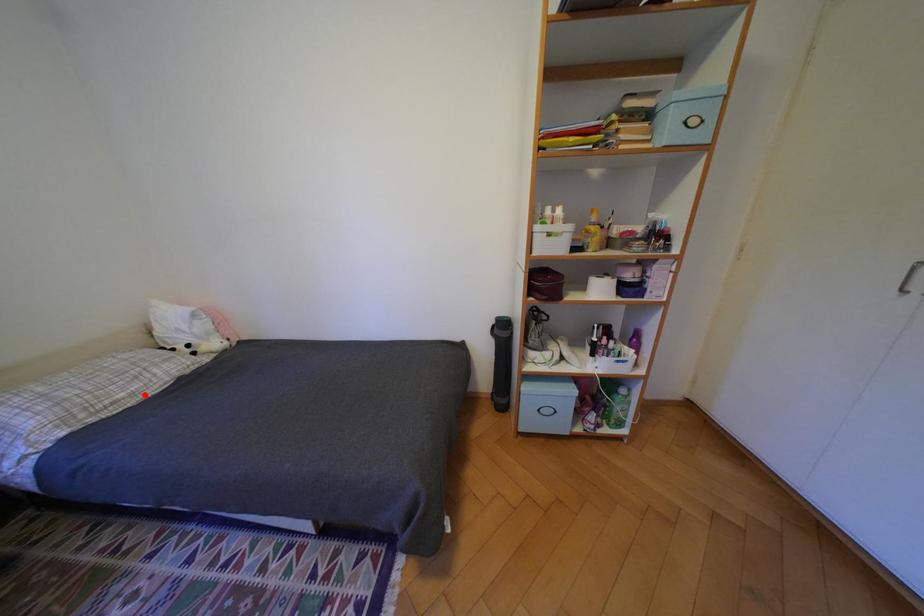
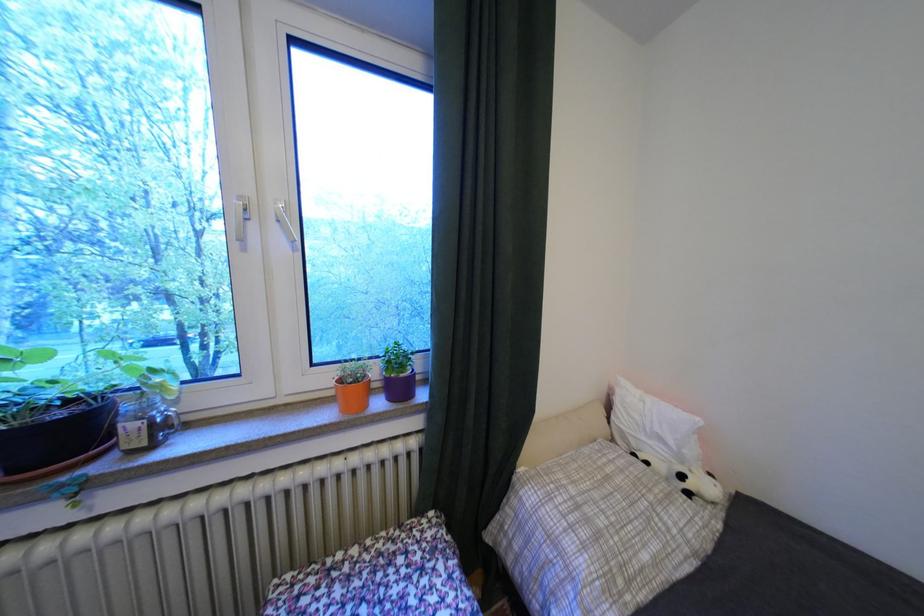
Find the pixel in the second image that matches the highlighted location in the first image.

(667, 562)